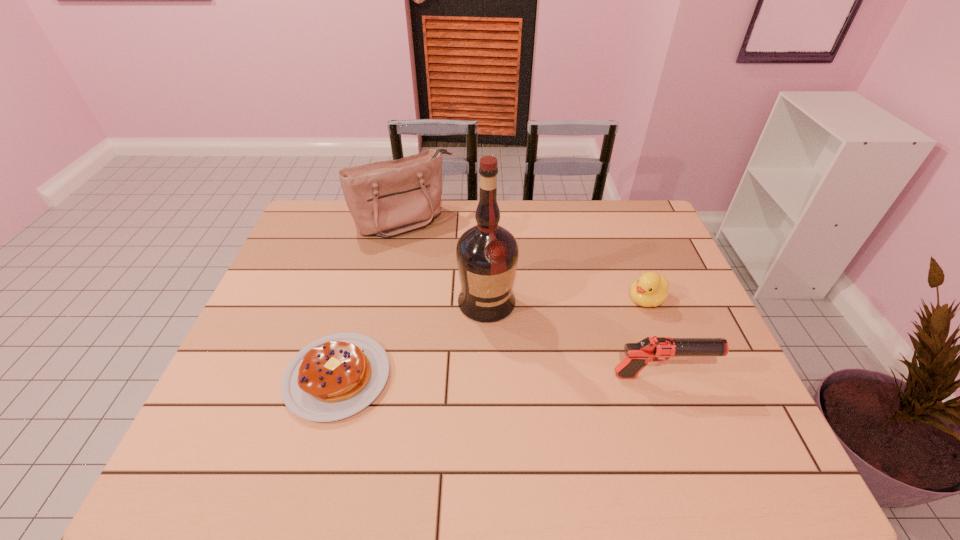
At what (x,y) coordinates should I click in order to perform the action: click on vacant area situated 0.140m on the surface of the third object from right to left. Please return your answer as a coordinate pair (x, y). The height and width of the screenshot is (540, 960). Looking at the image, I should click on (517, 362).

I want to click on blank area located on the surface of the third object from right to left, so click(544, 414).

At what (x,y) coordinates should I click in order to perform the action: click on vacant space located on the beak of the fourth tallest object. Please return your answer as a coordinate pair (x, y). The width and height of the screenshot is (960, 540). Looking at the image, I should click on (535, 374).

You are a GUI agent. You are given a task and a screenshot of the screen. Output one action in this format:
    pyautogui.click(x=<x>, y=<y>)
    Task: Click on the free space located on the beak of the fourth tallest object
    Image resolution: width=960 pixels, height=540 pixels.
    Given the screenshot: What is the action you would take?
    pyautogui.click(x=600, y=330)

Identify the location of vacant space positioned 0.080m on the beak of the fourth tallest object. The height and width of the screenshot is (540, 960). (615, 320).

You are a GUI agent. You are given a task and a screenshot of the screen. Output one action in this format:
    pyautogui.click(x=<x>, y=<y>)
    Task: Click on the free space located on the front pocket of the farthest object
    
    Given the screenshot: What is the action you would take?
    pyautogui.click(x=446, y=267)

This screenshot has width=960, height=540. I want to click on free space located on the front pocket of the farthest object, so click(442, 261).

Find the location of `free space located on the front pocket of the farthest object`. free space located on the front pocket of the farthest object is located at coordinates (452, 275).

Locate an element on the screen. The width and height of the screenshot is (960, 540). object located at the far edge is located at coordinates (387, 198).

Identify the location of object that is at the near edge. (334, 377).